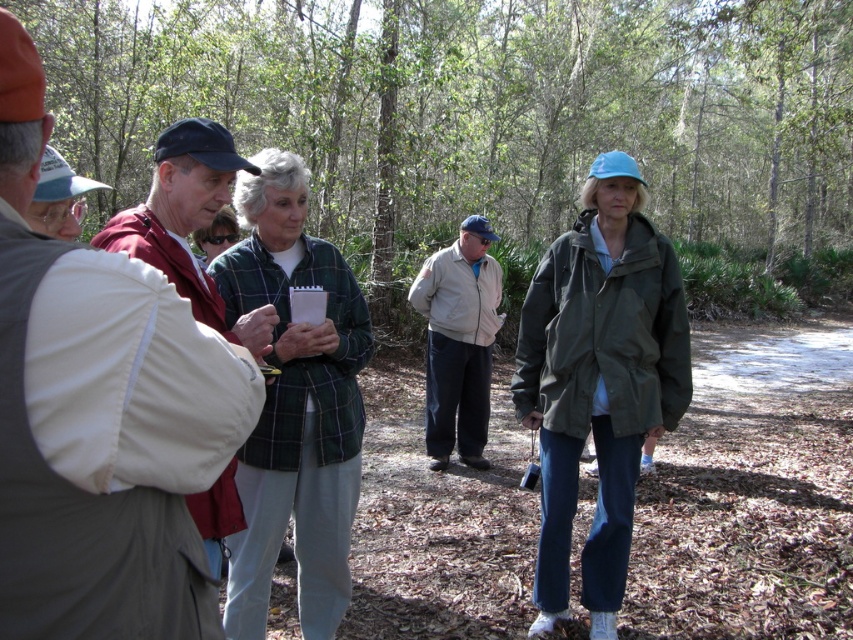
You are part of the group in the forest and need to decide where to place a small picnic basket. The basket must be placed between the green leafy tree at center and the green plaid shirt at center. Which object should the basket be closer to if it needs to be near the larger object?

The green leafy tree at center is bigger than the green plaid shirt at center, so the picnic basket should be placed closer to the green leafy tree at center.

You are standing in the forest and want to touch both the green leafy tree at center and the light beige jacket at center. Which object should you reach for first?

You should reach for the green leafy tree at center first because it is closer to you than the light beige jacket at center.